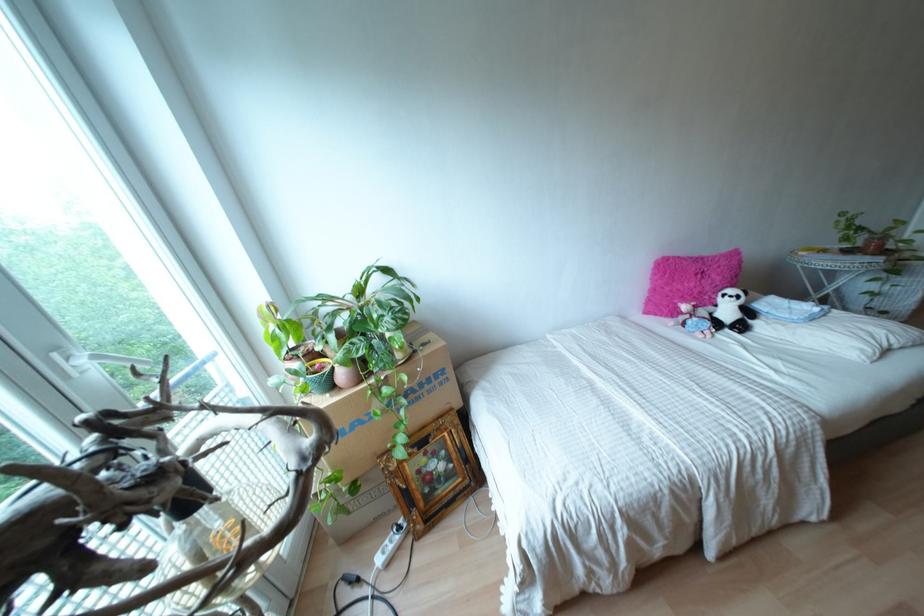
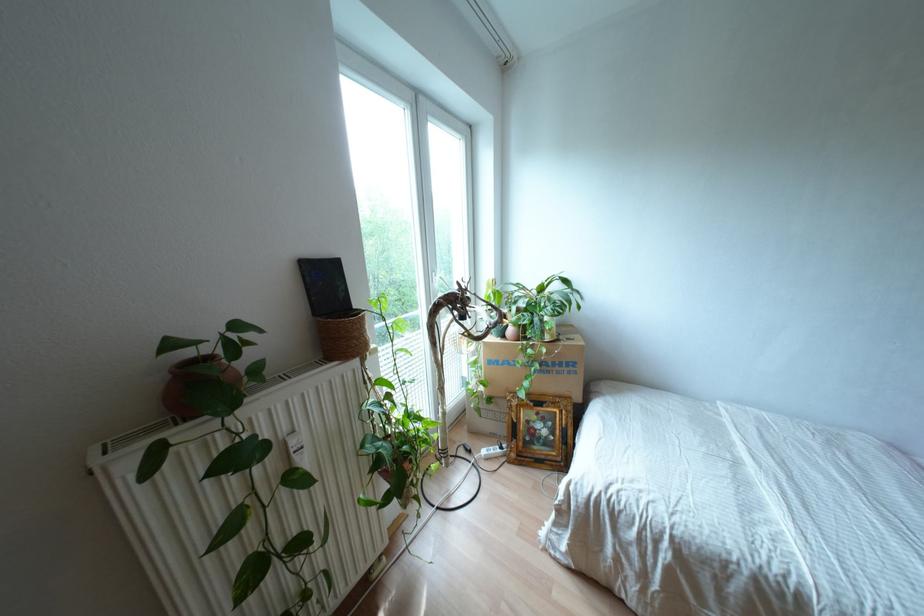
Where in the second image is the point corresponding to point 342,374 from the first image?

(509, 330)